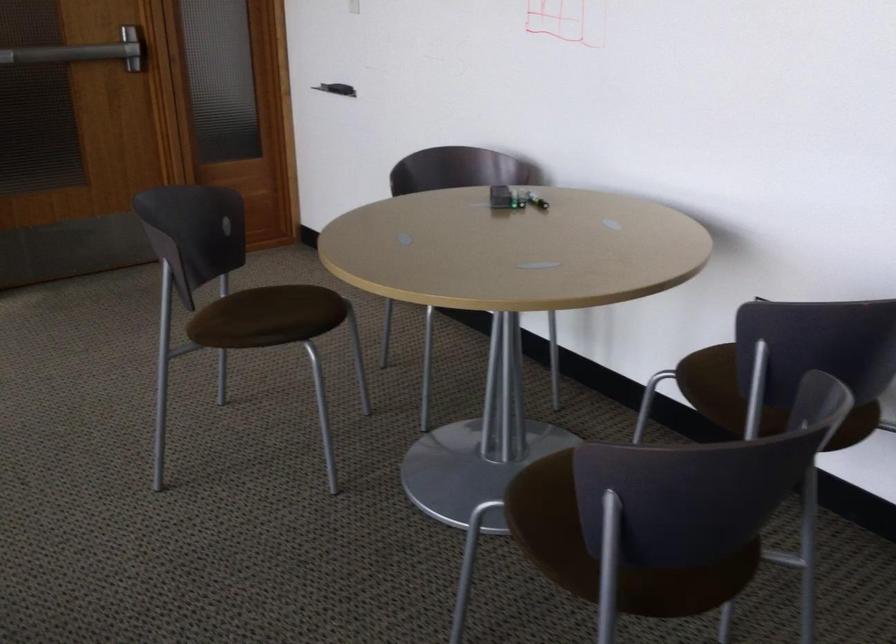
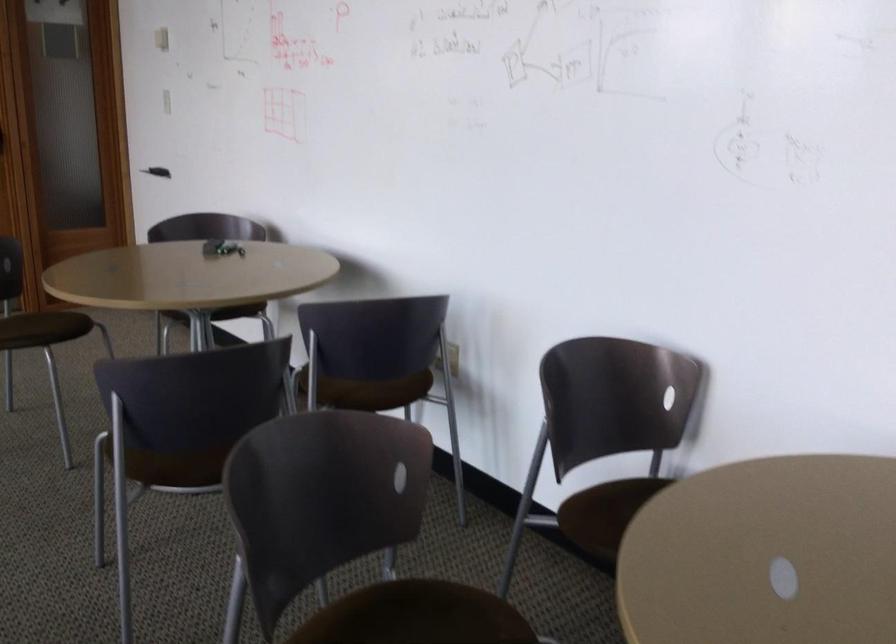
Find the pixel in the second image that matches the point at 510,212 in the first image.

(221, 248)